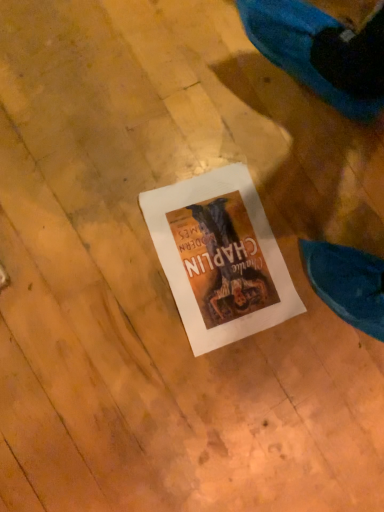
You are a GUI agent. You are given a task and a screenshot of the screen. Output one action in this format:
    pyautogui.click(x=<x>, y=<y>)
    Task: Click on the free location in front of white paper poster at center
    Image resolution: width=384 pixels, height=512 pixels.
    Given the screenshot: What is the action you would take?
    pyautogui.click(x=142, y=352)